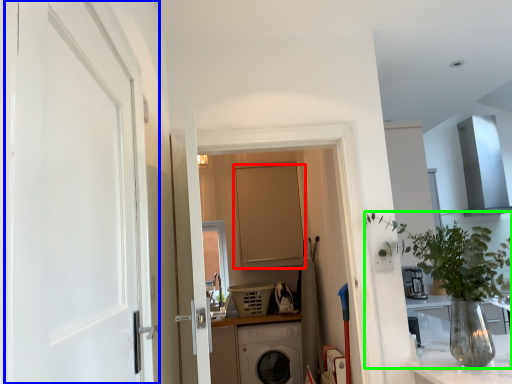
Question: Considering the real-world distances, which object is farthest from door (highlighted by a red box)? door (highlighted by a blue box) or houseplant (highlighted by a green box)?

Choices:
 (A) door
 (B) houseplant

Answer: (A)